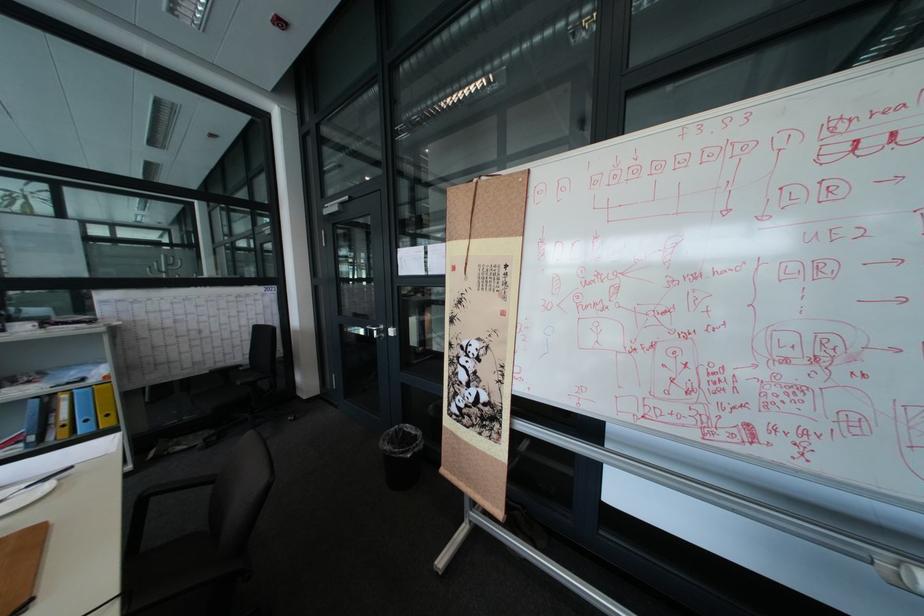
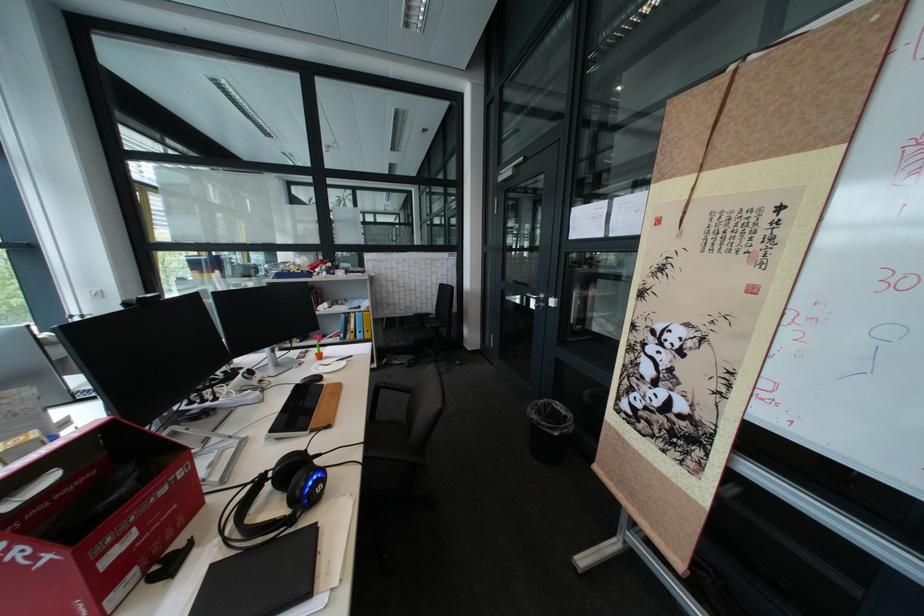
In the second image, find the point that corresponds to pixel 79 397 in the first image.

(367, 315)